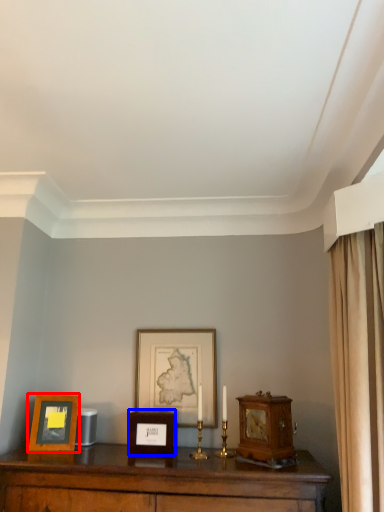
Question: Which point is closer to the camera, picture frame (highlighted by a red box) or picture frame (highlighted by a blue box)?

Choices:
 (A) picture frame
 (B) picture frame

Answer: (A)